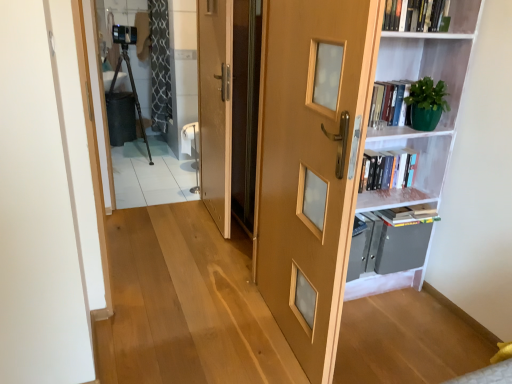
This screenshot has width=512, height=384. I want to click on vacant space to the right of light brown wooden door at center, which appears as the 1th door when viewed from the right, so click(x=390, y=342).